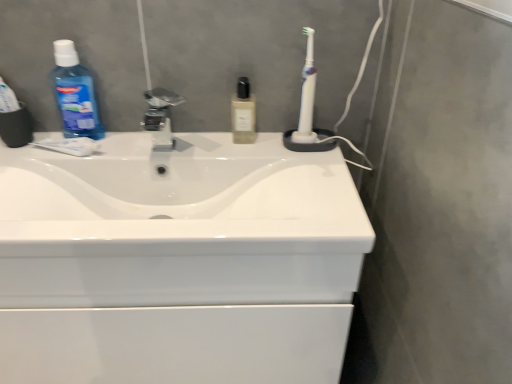
Where is `vacant area that lies between blue translucent mouthwash at left and white plastic toothbrush at upper right`? vacant area that lies between blue translucent mouthwash at left and white plastic toothbrush at upper right is located at coordinates (181, 139).